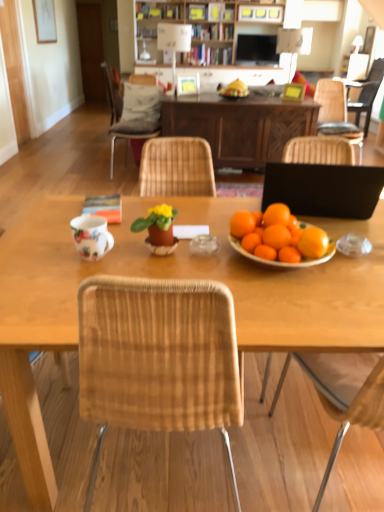
Question: Does wooden table at center have a lesser height compared to black matte laptop at right?

Choices:
 (A) no
 (B) yes

Answer: (A)

Question: Considering the relative sizes of wooden table at center and black matte laptop at right in the image provided, is wooden table at center thinner than black matte laptop at right?

Choices:
 (A) yes
 (B) no

Answer: (B)

Question: Is wooden table at center beside black matte laptop at right?

Choices:
 (A) no
 (B) yes

Answer: (A)

Question: Is wooden table at center at the left side of black matte laptop at right?

Choices:
 (A) no
 (B) yes

Answer: (B)

Question: Does wooden table at center appear on the right side of black matte laptop at right?

Choices:
 (A) no
 (B) yes

Answer: (A)

Question: Considering the positions of matte clay pot at center and wooden table at center in the image, is matte clay pot at center taller or shorter than wooden table at center?

Choices:
 (A) tall
 (B) short

Answer: (B)

Question: From the image's perspective, is matte clay pot at center above or below wooden table at center?

Choices:
 (A) below
 (B) above

Answer: (A)

Question: In the image, is matte clay pot at center positioned in front of or behind wooden table at center?

Choices:
 (A) behind
 (B) front

Answer: (B)

Question: In terms of size, does matte clay pot at center appear bigger or smaller than wooden table at center?

Choices:
 (A) big
 (B) small

Answer: (B)

Question: Considering the positions of matte white picture frame at center, the second picture frame from the back, and matte black television at upper center in the image, is matte white picture frame at center, the second picture frame from the back, taller or shorter than matte black television at upper center?

Choices:
 (A) short
 (B) tall

Answer: (A)

Question: Is matte white picture frame at center, the second picture frame ordered from the bottom, in front of or behind matte black television at upper center in the image?

Choices:
 (A) front
 (B) behind

Answer: (A)

Question: In terms of width, does matte white picture frame at center, the second picture frame ordered from the bottom, look wider or thinner when compared to matte black television at upper center?

Choices:
 (A) wide
 (B) thin

Answer: (B)

Question: From the image's perspective, relative to matte black television at upper center, is matte white picture frame at center, the second picture frame from the back, above or below?

Choices:
 (A) above
 (B) below

Answer: (B)

Question: From a real-world perspective, is woven wood chair at upper left, the second chair positioned from the back, above or below wooden table at center?

Choices:
 (A) above
 (B) below

Answer: (A)

Question: In terms of width, does woven wood chair at upper left, the first chair viewed from the left, look wider or thinner when compared to wooden table at center?

Choices:
 (A) thin
 (B) wide

Answer: (A)